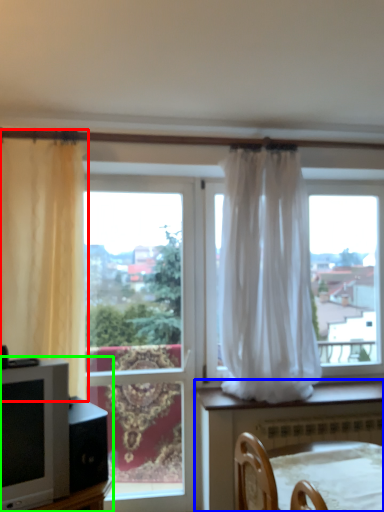
Question: Estimate the real-world distances between objects in this image. Which object is closer to curtain (highlighted by a red box), furniture (highlighted by a blue box) or entertainment center (highlighted by a green box)?

Choices:
 (A) furniture
 (B) entertainment center

Answer: (B)